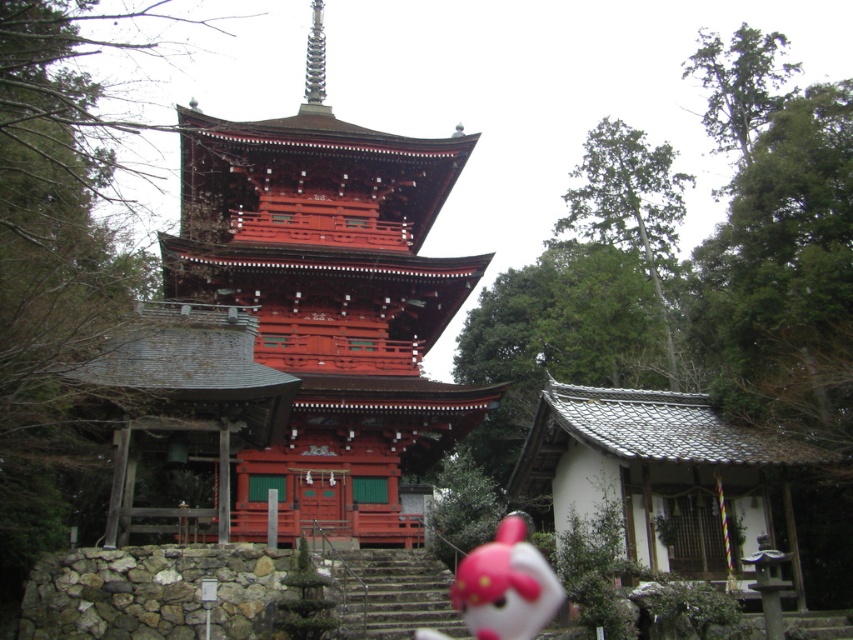
Is stone stairs at center bigger than matte pink plush toy at lower center?

No.

Is stone stairs at center to the left of matte pink plush toy at lower center from the viewer's perspective?

Yes, stone stairs at center is to the left of matte pink plush toy at lower center.

Is point (428, 556) farther from viewer compared to point (434, 637)?

Yes, point (428, 556) is farther from viewer.

Identify the location of stone stairs at center. This screenshot has width=853, height=640. (390, 593).

In the scene shown: Does shiny lacquered pagoda at center have a greater width compared to stone stairs at center?

Indeed, shiny lacquered pagoda at center has a greater width compared to stone stairs at center.

This screenshot has width=853, height=640. In order to click on shiny lacquered pagoda at center in this screenshot , I will do `click(294, 326)`.

Does shiny lacquered pagoda at center have a larger size compared to matte pink plush toy at lower center?

Yes.

Locate an element on the screen. This screenshot has height=640, width=853. shiny lacquered pagoda at center is located at coordinates (294, 326).

Locate an element on the screen. This screenshot has width=853, height=640. shiny lacquered pagoda at center is located at coordinates (294, 326).